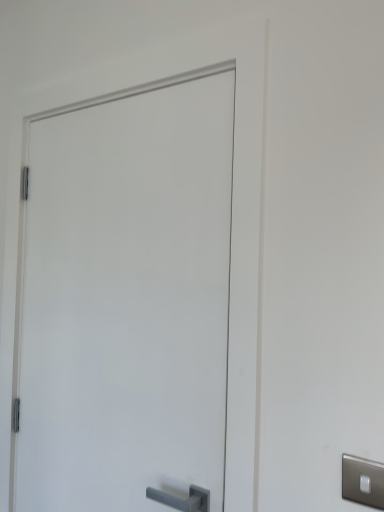
Question: From a real-world perspective, is satin nickel switch at lower right physically below white matte door at center?

Choices:
 (A) yes
 (B) no

Answer: (A)

Question: Is satin nickel switch at lower right to the right of white matte door at center from the viewer's perspective?

Choices:
 (A) yes
 (B) no

Answer: (A)

Question: Does satin nickel switch at lower right come in front of white matte door at center?

Choices:
 (A) yes
 (B) no

Answer: (A)

Question: From a real-world perspective, is satin nickel switch at lower right located higher than white matte door at center?

Choices:
 (A) no
 (B) yes

Answer: (A)

Question: Considering the relative sizes of satin nickel switch at lower right and white matte door at center in the image provided, is satin nickel switch at lower right taller than white matte door at center?

Choices:
 (A) no
 (B) yes

Answer: (A)

Question: Is satin nickel switch at lower right positioned behind white matte door at center?

Choices:
 (A) yes
 (B) no

Answer: (B)

Question: From a real-world perspective, does white matte door at center stand above satin nickel switch at lower right?

Choices:
 (A) yes
 (B) no

Answer: (A)

Question: Considering the relative sizes of white matte door at center and satin nickel switch at lower right in the image provided, is white matte door at center thinner than satin nickel switch at lower right?

Choices:
 (A) yes
 (B) no

Answer: (B)

Question: Can you confirm if white matte door at center is positioned to the right of satin nickel switch at lower right?

Choices:
 (A) yes
 (B) no

Answer: (B)

Question: From the image's perspective, is white matte door at center on satin nickel switch at lower right?

Choices:
 (A) no
 (B) yes

Answer: (B)

Question: Considering the relative sizes of white matte door at center and satin nickel switch at lower right in the image provided, is white matte door at center bigger than satin nickel switch at lower right?

Choices:
 (A) no
 (B) yes

Answer: (B)

Question: Would you say white matte door at center is a long distance from satin nickel switch at lower right?

Choices:
 (A) yes
 (B) no

Answer: (B)

Question: Is satin nickel switch at lower right spatially inside white matte door at center, or outside of it?

Choices:
 (A) inside
 (B) outside

Answer: (B)